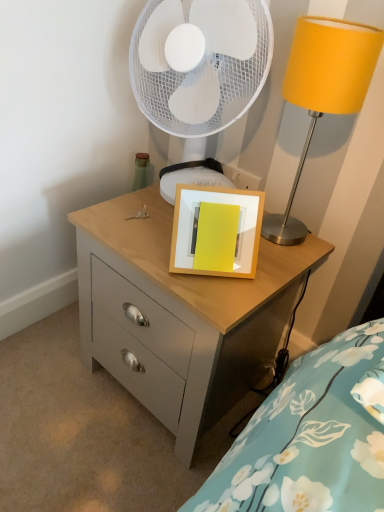
Question: Is white mesh mechanical fan at upper center bigger than wooden picture frame at center?

Choices:
 (A) no
 (B) yes

Answer: (B)

Question: Is white mesh mechanical fan at upper center looking in the opposite direction of wooden picture frame at center?

Choices:
 (A) yes
 (B) no

Answer: (B)

Question: Can you confirm if white mesh mechanical fan at upper center is taller than wooden picture frame at center?

Choices:
 (A) no
 (B) yes

Answer: (B)

Question: From the image's perspective, is white mesh mechanical fan at upper center over wooden picture frame at center?

Choices:
 (A) no
 (B) yes

Answer: (B)

Question: Can you confirm if white mesh mechanical fan at upper center is smaller than wooden picture frame at center?

Choices:
 (A) yes
 (B) no

Answer: (B)

Question: From a real-world perspective, is metallic yellow lampshade at upper right physically located above or below wooden picture frame at center?

Choices:
 (A) above
 (B) below

Answer: (A)

Question: Based on their sizes in the image, would you say metallic yellow lampshade at upper right is bigger or smaller than wooden picture frame at center?

Choices:
 (A) small
 (B) big

Answer: (B)

Question: Is point (302, 25) positioned closer to the camera than point (240, 210)?

Choices:
 (A) closer
 (B) farther

Answer: (A)

Question: Relative to wooden picture frame at center, is metallic yellow lampshade at upper right in front or behind?

Choices:
 (A) behind
 (B) front

Answer: (B)

Question: From the image's perspective, is matte wood chest of drawers at center positioned above or below wooden picture frame at center?

Choices:
 (A) below
 (B) above

Answer: (A)

Question: Considering the positions of matte wood chest of drawers at center and wooden picture frame at center in the image, is matte wood chest of drawers at center bigger or smaller than wooden picture frame at center?

Choices:
 (A) small
 (B) big

Answer: (B)

Question: Considering the positions of matte wood chest of drawers at center and wooden picture frame at center in the image, is matte wood chest of drawers at center taller or shorter than wooden picture frame at center?

Choices:
 (A) short
 (B) tall

Answer: (B)

Question: From a real-world perspective, is matte wood chest of drawers at center above or below wooden picture frame at center?

Choices:
 (A) above
 (B) below

Answer: (B)

Question: From a real-world perspective, is matte wood chest of drawers at center physically located above or below white mesh mechanical fan at upper center?

Choices:
 (A) below
 (B) above

Answer: (A)

Question: From the image's perspective, is matte wood chest of drawers at center located above or below white mesh mechanical fan at upper center?

Choices:
 (A) below
 (B) above

Answer: (A)